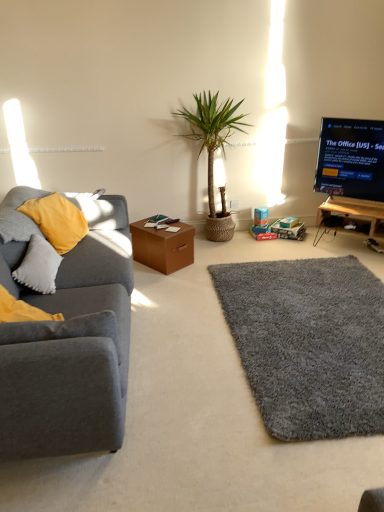
Question: Can you see black glossy tv at upper right touching gray shaggy rug at lower right?

Choices:
 (A) no
 (B) yes

Answer: (A)

Question: Does black glossy tv at upper right lie behind gray shaggy rug at lower right?

Choices:
 (A) yes
 (B) no

Answer: (A)

Question: Does black glossy tv at upper right have a larger size compared to gray shaggy rug at lower right?

Choices:
 (A) yes
 (B) no

Answer: (B)

Question: Is black glossy tv at upper right completely or partially outside of gray shaggy rug at lower right?

Choices:
 (A) no
 (B) yes

Answer: (B)

Question: Does black glossy tv at upper right have a greater width compared to gray shaggy rug at lower right?

Choices:
 (A) no
 (B) yes

Answer: (A)

Question: Does black glossy tv at upper right lie in front of gray shaggy rug at lower right?

Choices:
 (A) no
 (B) yes

Answer: (A)

Question: From a real-world perspective, does wooden tv stand at right stand above matte gray couch at left?

Choices:
 (A) yes
 (B) no

Answer: (B)

Question: Is wooden tv stand at right outside matte gray couch at left?

Choices:
 (A) yes
 (B) no

Answer: (A)

Question: Considering the relative sizes of wooden tv stand at right and matte gray couch at left in the image provided, is wooden tv stand at right smaller than matte gray couch at left?

Choices:
 (A) no
 (B) yes

Answer: (B)

Question: Does wooden tv stand at right turn towards matte gray couch at left?

Choices:
 (A) yes
 (B) no

Answer: (A)

Question: Is wooden tv stand at right far from matte gray couch at left?

Choices:
 (A) yes
 (B) no

Answer: (A)

Question: Can you confirm if wooden tv stand at right is positioned to the right of matte gray couch at left?

Choices:
 (A) yes
 (B) no

Answer: (A)

Question: Does gray shaggy rug at lower right have a greater height compared to wooden tv stand at right?

Choices:
 (A) no
 (B) yes

Answer: (A)